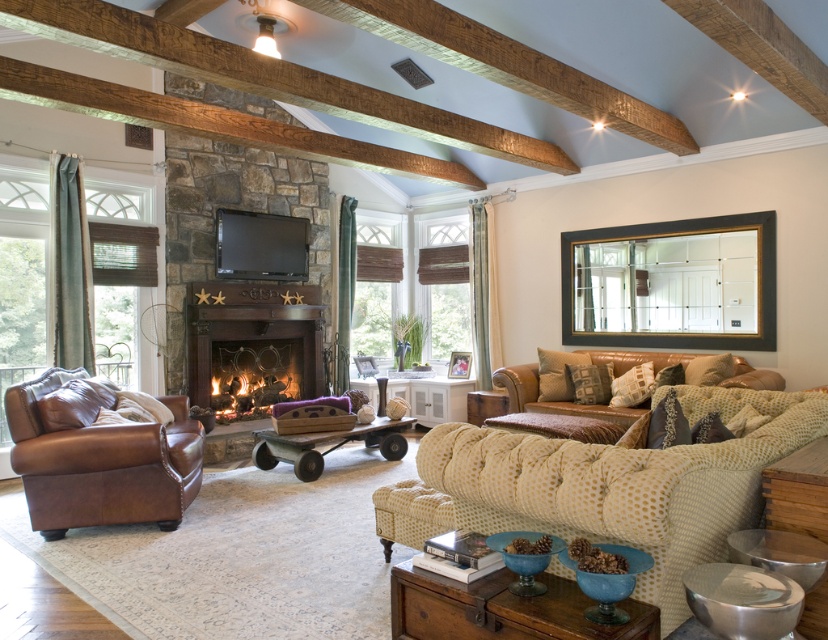
Question: Can you confirm if yellow dotted fabric couch at center is positioned above wooden wagon at center?

Choices:
 (A) yes
 (B) no

Answer: (A)

Question: Does yellow dotted fabric couch at center have a smaller size compared to rustic wood coffee table at center?

Choices:
 (A) no
 (B) yes

Answer: (A)

Question: Does brown leather armchair at left have a larger size compared to rustic wood coffee table at center?

Choices:
 (A) yes
 (B) no

Answer: (A)

Question: Considering the real-world distances, which object is farthest from the rustic wood coffee table at center?

Choices:
 (A) brown leather armchair at left
 (B) wooden wagon at center
 (C) leather couch at right

Answer: (C)

Question: Which object appears closest to the camera in this image?

Choices:
 (A) brown leather armchair at left
 (B) wooden wagon at center

Answer: (A)

Question: Based on their relative distances, which object is nearer to the yellow dotted fabric couch at center?

Choices:
 (A) brown leather armchair at left
 (B) wooden wagon at center
 (C) rustic wood coffee table at center

Answer: (C)